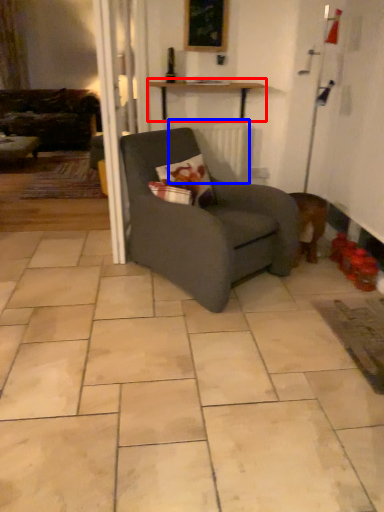
Question: Which of the following is the closest to the observer, table (highlighted by a red box) or radiator (highlighted by a blue box)?

Choices:
 (A) table
 (B) radiator

Answer: (A)